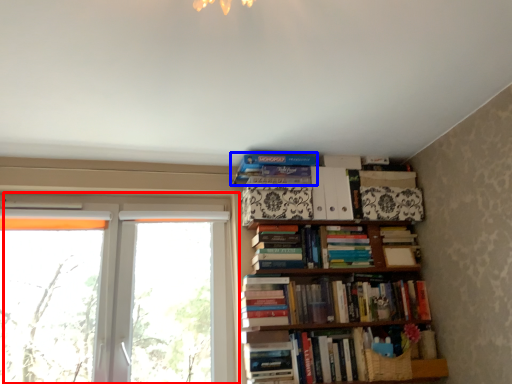
Question: Which point is further to the camera, window (highlighted by a red box) or book (highlighted by a blue box)?

Choices:
 (A) window
 (B) book

Answer: (B)